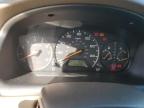
Where is `screw hole`? screw hole is located at coordinates (51, 14), (129, 21).